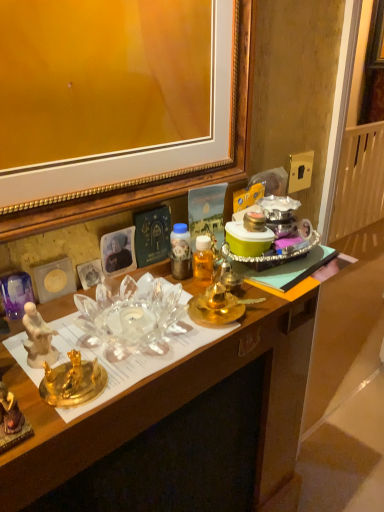
You are a GUI agent. You are given a task and a screenshot of the screen. Output one action in this format:
    pyautogui.click(x=<x>, y=<y>)
    Task: Click on the empty space that is ontop of transparent glass bowl at center (from a real-world perspective)
    
    Given the screenshot: What is the action you would take?
    pyautogui.click(x=169, y=315)